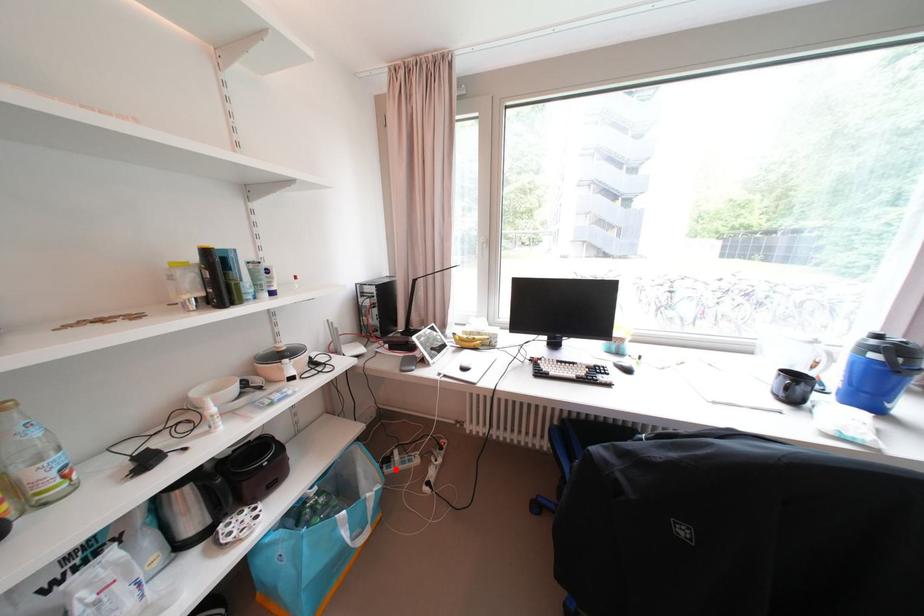
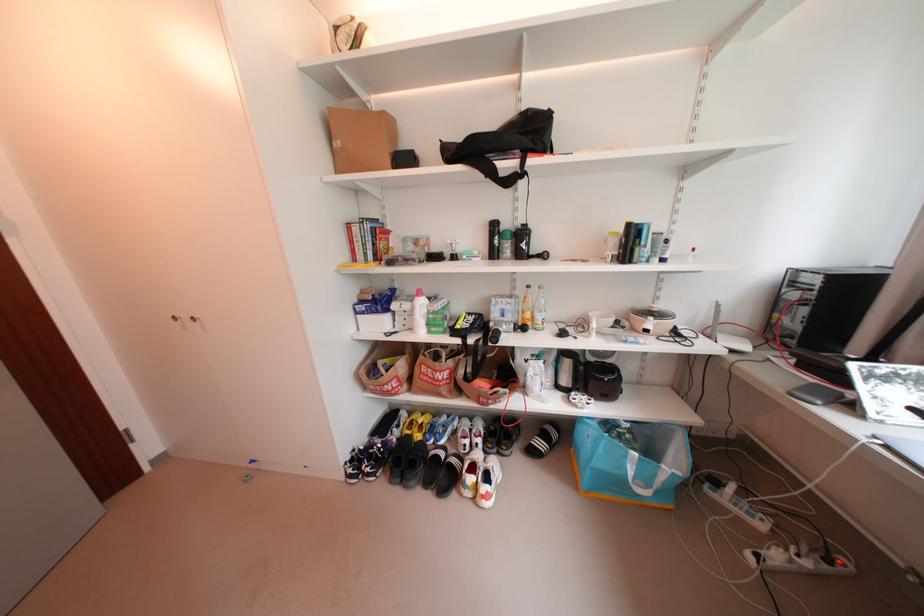
Question: I am providing you with two images of the same scene from different viewpoints. A red point is marked on the first image. Can you still see the location of the red point in image 2?

Choices:
 (A) Yes
 (B) No

Answer: (A)